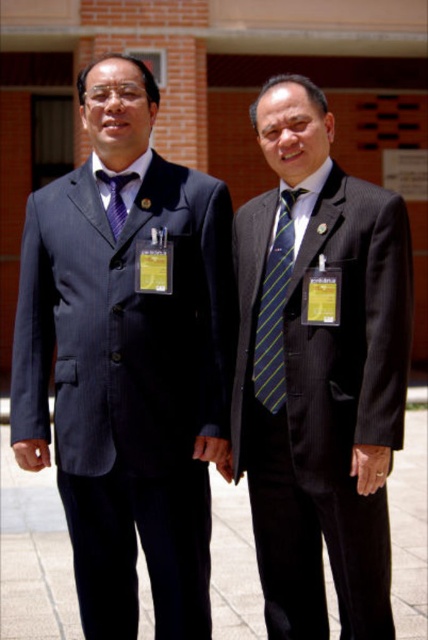
Looking at this image, you are organizing a formal event and need to ensure that the matte black suit at left and the matte purple tie at left are displayed together in an exhibition. Given their sizes, which object should be placed first in the display case to ensure proper visibility?

The matte black suit at left should be placed first in the display case because it is larger than the matte purple tie at left, ensuring it is visible and takes up the appropriate space.